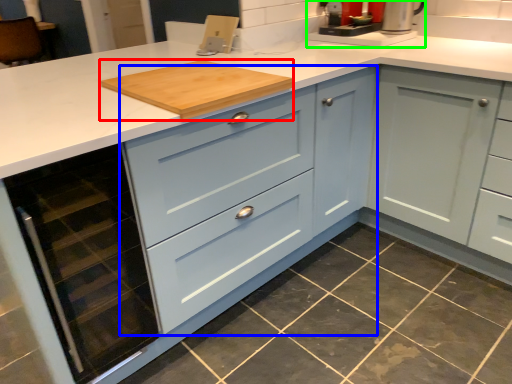
Question: Which object is the farthest from cutting board (highlighted by a red box)? Choose among these: cabinetry (highlighted by a blue box) or coffee machine (highlighted by a green box).

Choices:
 (A) cabinetry
 (B) coffee machine

Answer: (B)